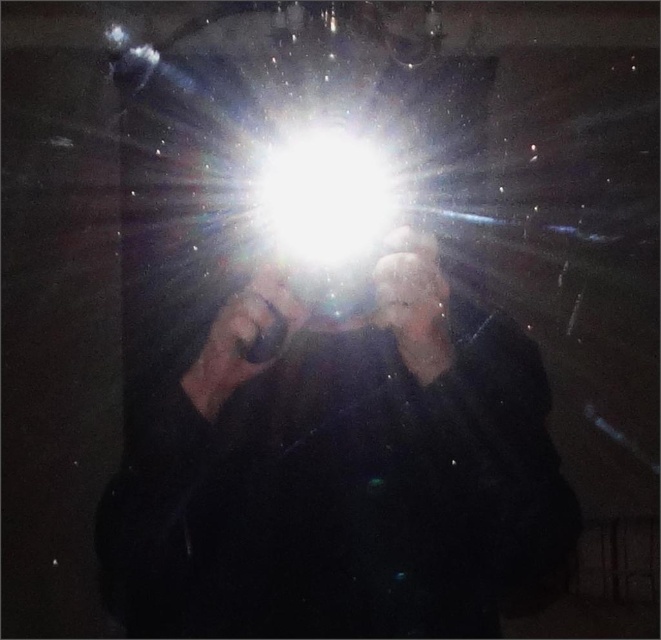
You are a photographer trying to capture the scene. The black matte flashlight at center and the white glossy light at center are in your shot. Which object is placed lower in the image?

The black matte flashlight at center is positioned under the white glossy light at center, so it is placed lower in the image.

You are a photographer trying to capture the scene. The black matte flashlight at center and the white glossy light at center are both in your frame. Which object is closer to the camera according to the scene?

The black matte flashlight at center is in front of the white glossy light at center, so the flashlight is closer to the camera.